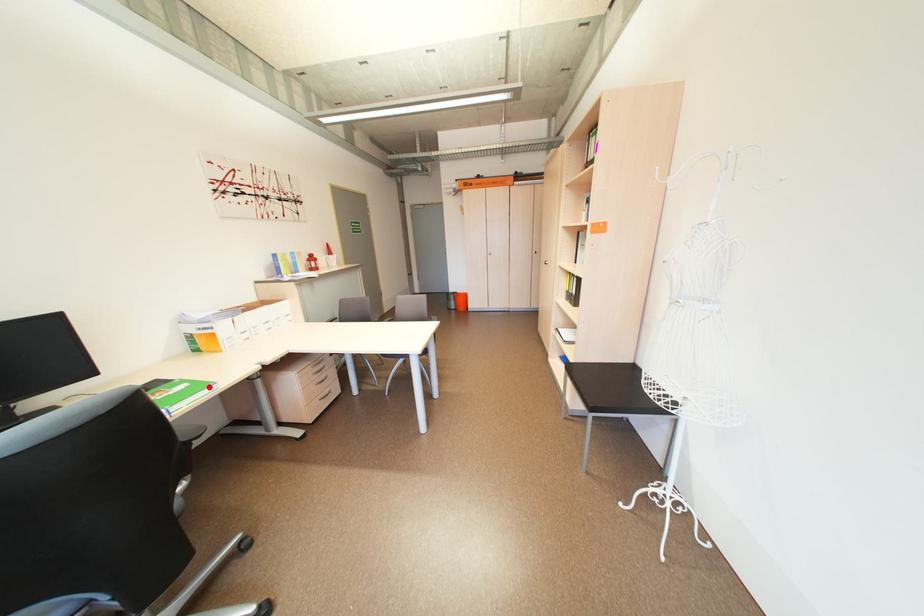
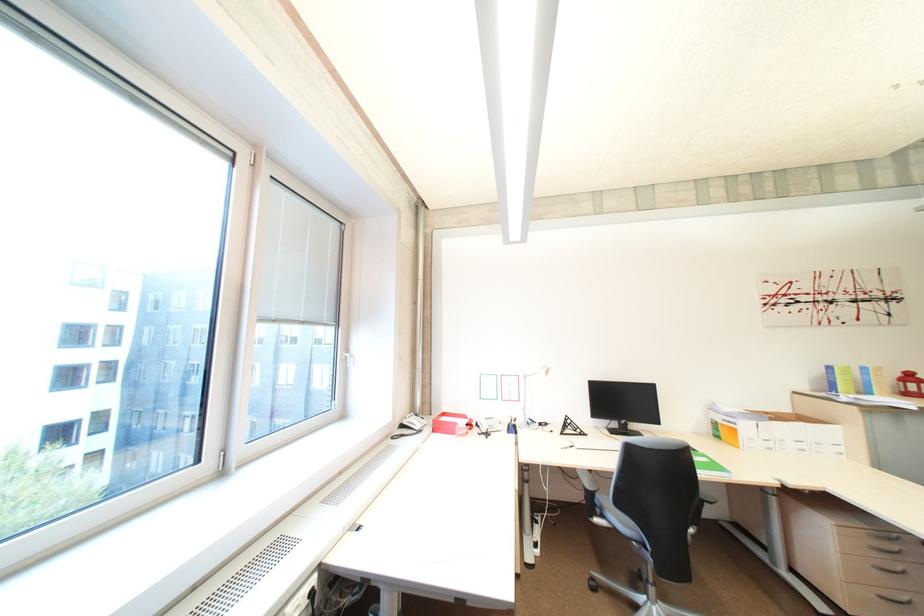
Locate, in the second image, the point that corresponds to the highlighted location in the first image.

(725, 468)